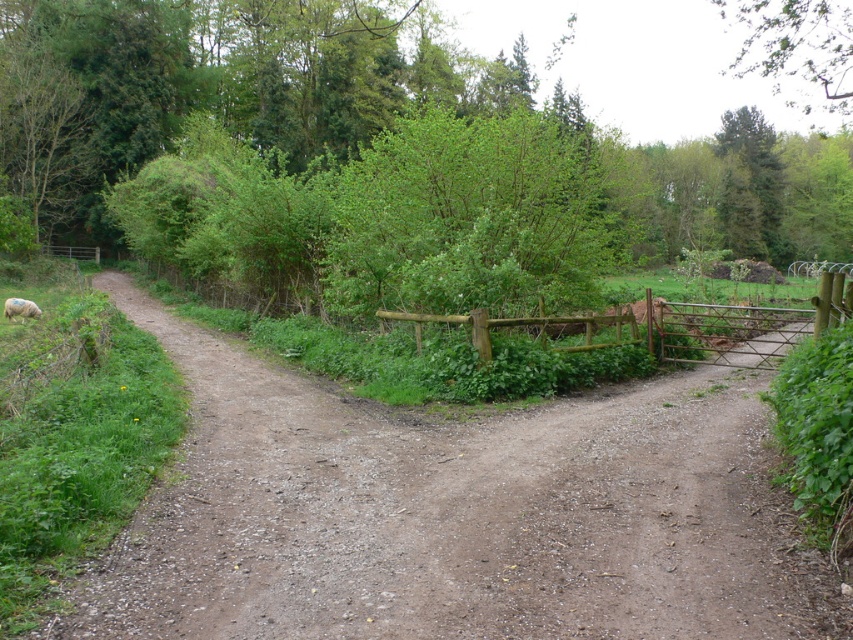
You are a hiker standing at the start of the path. You see the brown gravel dirt track at center and the white woolly sheep at lower left. Which object is nearer to you?

The brown gravel dirt track at center is closer to the viewer than the white woolly sheep at lower left, so the brown gravel dirt track at center is nearer to you.

You are standing at the starting point of the dirt path and want to walk towards the brown wooden fence at center. Which direction should you head?

The brown wooden fence at center is located at point coordinates of 0.512 on the x axis and 0.872 on the y axis. Since you are at the starting point, you should head towards the direction where the coordinates increase in the y axis, which would be forward along the path.

You are a hiker trying to decide which path to take. You see the brown gravel dirt track at center and the green leafy tree at upper right. Which object is larger in size?

The green leafy tree at upper right is larger than the brown gravel dirt track at center.